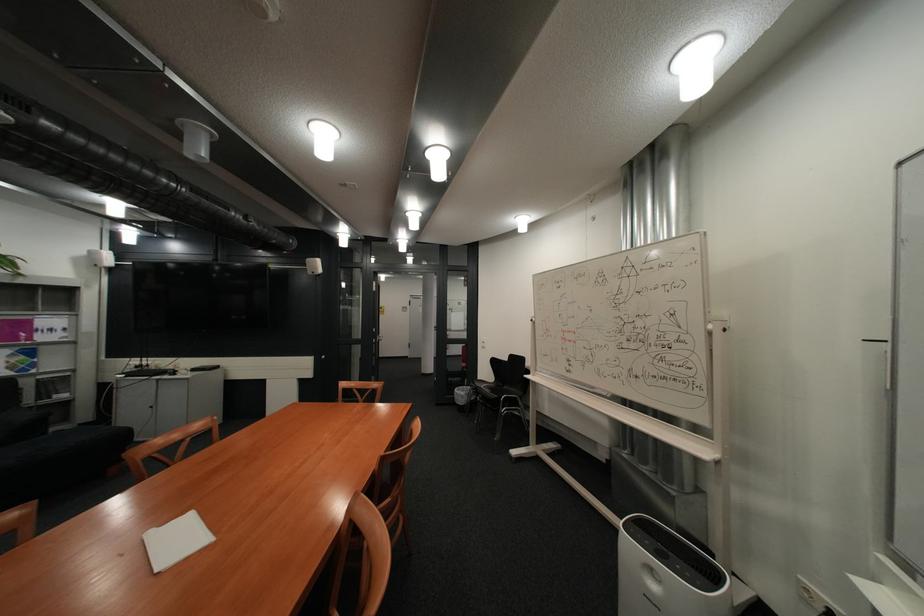
You are a GUI agent. You are given a task and a screenshot of the screen. Output one action in this format:
    pyautogui.click(x=<x>, y=<y>)
    Task: Click on the red fire extinguisher
    This screenshot has width=924, height=616.
    Given the screenshot: What is the action you would take?
    [x=464, y=355]